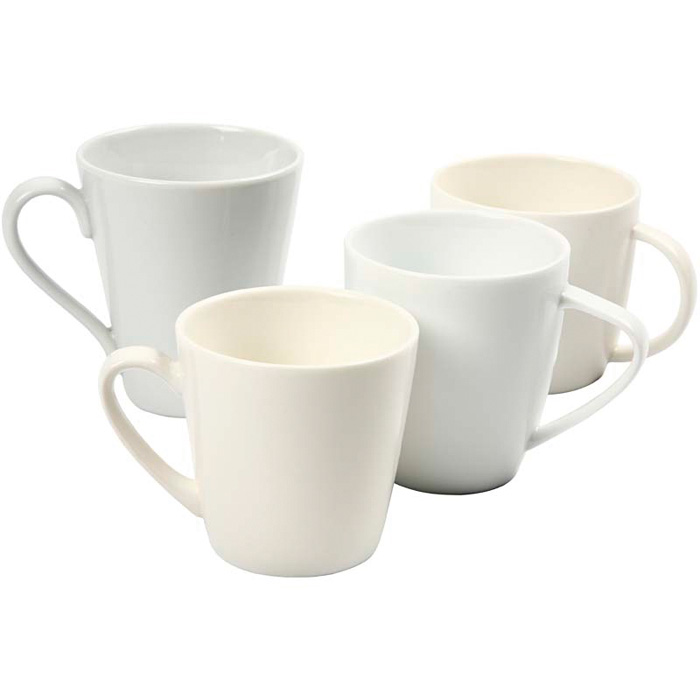
Identify the location of coffee mug. This screenshot has width=700, height=700. (173, 264), (283, 470), (458, 398), (594, 269).